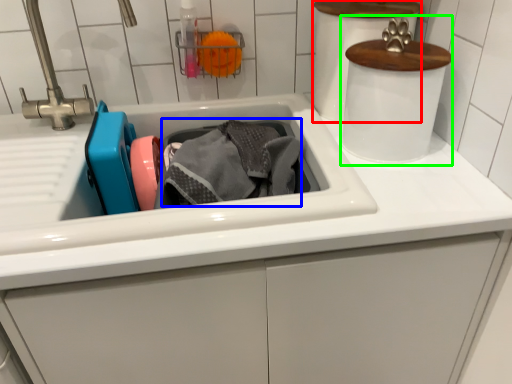
Question: Which is nearer to the appliance (highlighted by a red box)? material (highlighted by a blue box) or appliance (highlighted by a green box).

Choices:
 (A) material
 (B) appliance

Answer: (B)